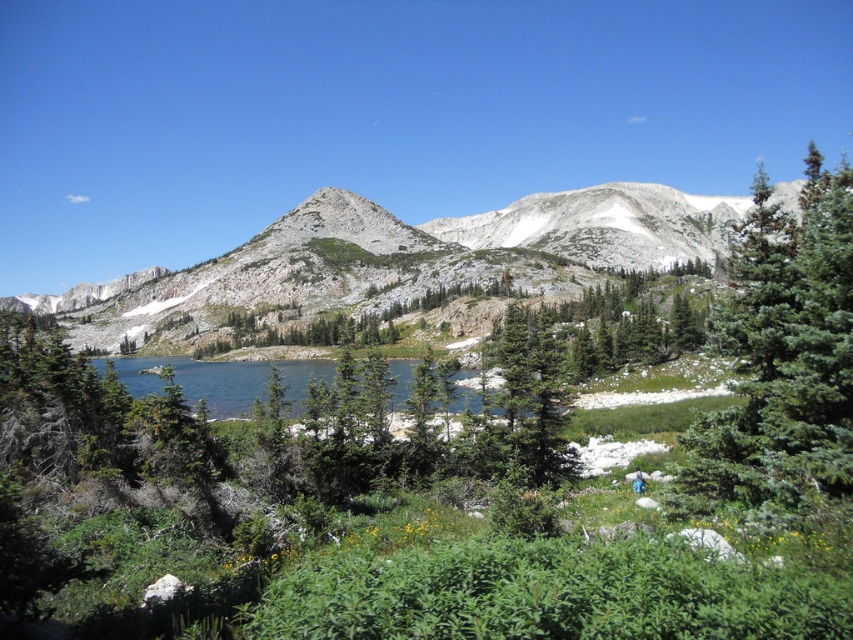
Question: Considering the relative positions of gray rocky mountain at center and green fir tree at right in the image provided, where is gray rocky mountain at center located with respect to green fir tree at right?

Choices:
 (A) right
 (B) left

Answer: (B)

Question: Is gray rocky mountain at center positioned at the back of green fir tree at right?

Choices:
 (A) no
 (B) yes

Answer: (B)

Question: Which point appears farthest from the camera in this image?

Choices:
 (A) tap(247, 401)
 (B) tap(799, 410)
 (C) tap(328, 236)

Answer: (C)

Question: Can you confirm if gray rocky mountain at center is positioned to the right of green fir tree at right?

Choices:
 (A) yes
 (B) no

Answer: (B)

Question: Which of these objects is positioned farthest from the green fir tree at right?

Choices:
 (A) gray rocky mountain at center
 (B) blue glassy water at center

Answer: (A)

Question: Which point is farther from the camera taking this photo?

Choices:
 (A) (183, 376)
 (B) (407, 250)

Answer: (B)